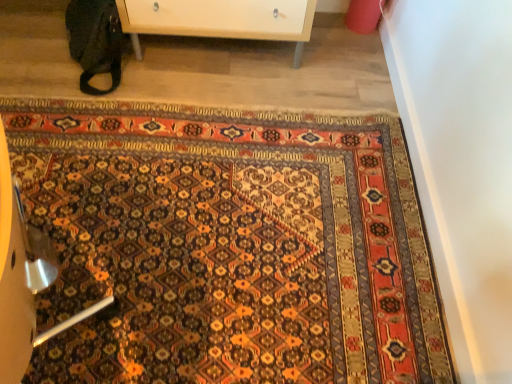
What do you see at coordinates (228, 245) in the screenshot? I see `carpet with intricate patterns at center` at bounding box center [228, 245].

Image resolution: width=512 pixels, height=384 pixels. I want to click on carpet with intricate patterns at center, so click(x=228, y=245).

You are a GUI agent. You are given a task and a screenshot of the screen. Output one action in this format:
    pyautogui.click(x=<x>, y=<y>)
    Task: Click on the carpet with intricate patterns at center
    
    Given the screenshot: What is the action you would take?
    pyautogui.click(x=228, y=245)